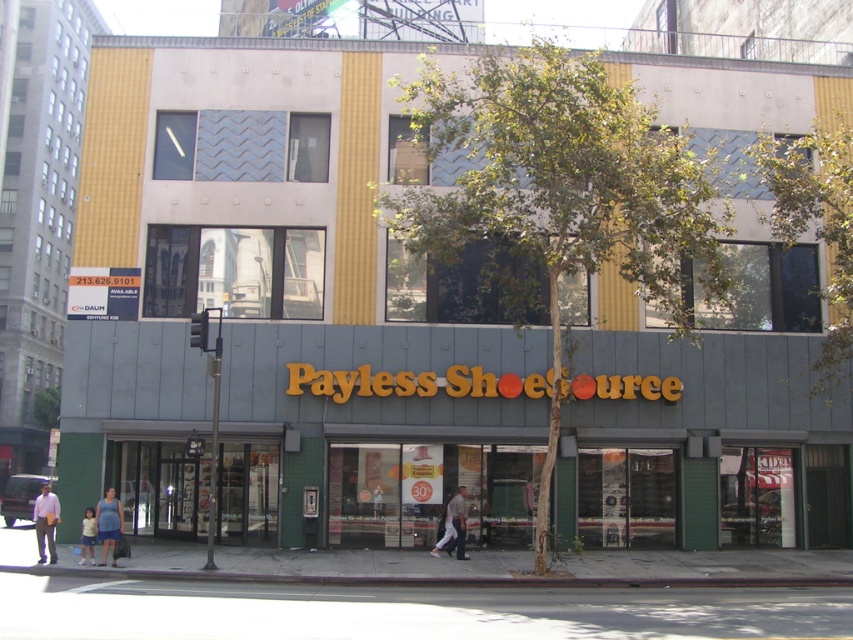
You are standing in front of the Payless ShoeSource store and notice two points on the building facade. The first point is at coordinates point (283,614) and the second is at point (463,541). Which point appears closer to you when looking at the store?

Point (283,614) is closer to the camera than point (463,541), so the first point appears closer to you.

You are a delivery person standing in front of the Payless ShoeSource store. You need to place a large box on the gray asphalt pavement at lower center and the blue denim shorts at lower center. Which surface can accommodate the box better?

The gray asphalt pavement at lower center has a larger size compared to the blue denim shorts at lower center, so it can accommodate the large box better.

You are standing in front of the Payless ShoeSource store and want to walk to the gray asphalt pavement at lower center. Based on the coordinates provided, can you determine the direction you should walk relative to the store entrance?

The gray asphalt pavement at lower center is located at coordinates point (408, 611). Since the store entrance is part of the lower section of the building, the pavement is directly in front of the entrance, so you should walk straight ahead towards it.